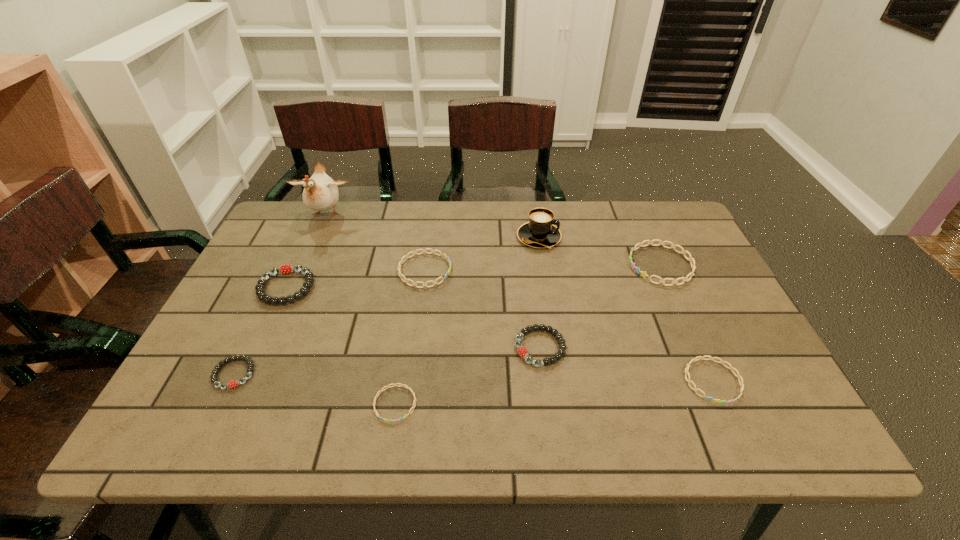
I want to click on vacant space at the far edge of the desktop, so click(x=602, y=220).

Where is `vacant space at the near edge of the desktop`? The image size is (960, 540). vacant space at the near edge of the desktop is located at coordinates pyautogui.click(x=508, y=445).

This screenshot has height=540, width=960. I want to click on free space at the left edge of the desktop, so click(269, 318).

In the image, there is a desktop. At what (x,y) coordinates should I click in order to perform the action: click on vacant region at the right edge. Please return your answer as a coordinate pair (x, y). The width and height of the screenshot is (960, 540). Looking at the image, I should click on (716, 318).

This screenshot has height=540, width=960. In the image, there is a desktop. Identify the location of vacant area at the far left corner. (287, 210).

What are the coordinates of `free region at the far right corner of the desktop` in the screenshot? It's located at (648, 208).

You are a GUI agent. You are given a task and a screenshot of the screen. Output one action in this format:
    pyautogui.click(x=<x>, y=<y>)
    Task: Click on the vacant area that lies between the black cappuccino and the rightmost black bracelet
    This screenshot has height=540, width=960.
    Given the screenshot: What is the action you would take?
    pyautogui.click(x=540, y=293)

Identify the location of unoccupied area between the rightmost black bracelet and the shortest object. (468, 376).

Where is `free area in between the smallest black bracelet and the biggest black bracelet`? This screenshot has height=540, width=960. free area in between the smallest black bracelet and the biggest black bracelet is located at coordinates (260, 330).

Image resolution: width=960 pixels, height=540 pixels. I want to click on free point between the second smallest blue bracelet and the bird, so click(519, 298).